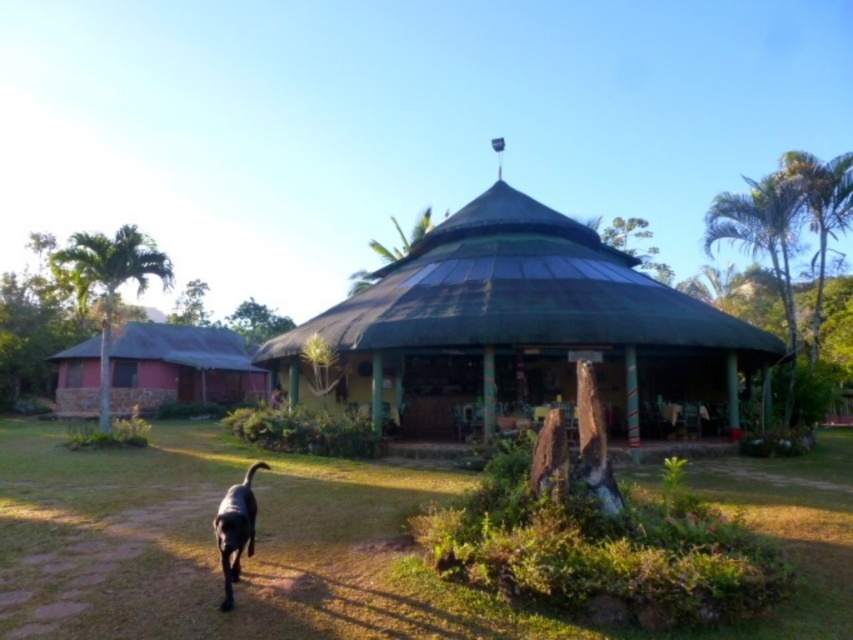
Is green grass at center above green thatched roof gazebo at center?

Actually, green grass at center is below green thatched roof gazebo at center.

Can you confirm if green grass at center is taller than green thatched roof gazebo at center?

No, green grass at center is not taller than green thatched roof gazebo at center.

This screenshot has height=640, width=853. What do you see at coordinates (311, 547) in the screenshot?
I see `green grass at center` at bounding box center [311, 547].

Image resolution: width=853 pixels, height=640 pixels. Find the location of `green grass at center`. green grass at center is located at coordinates (311, 547).

Which is more to the left, green grass at center or black glossy dog at lower left?

green grass at center

Between point (322, 554) and point (231, 490), which one is positioned behind?

The point (322, 554) is more distant.

The image size is (853, 640). I want to click on green grass at center, so click(311, 547).

Which is below, green grass at center or matte red hut at left?

Positioned lower is green grass at center.

Is point (538, 625) in front of point (131, 368)?

Yes, point (538, 625) is closer to viewer.

Where is `green grass at center`? green grass at center is located at coordinates (311, 547).